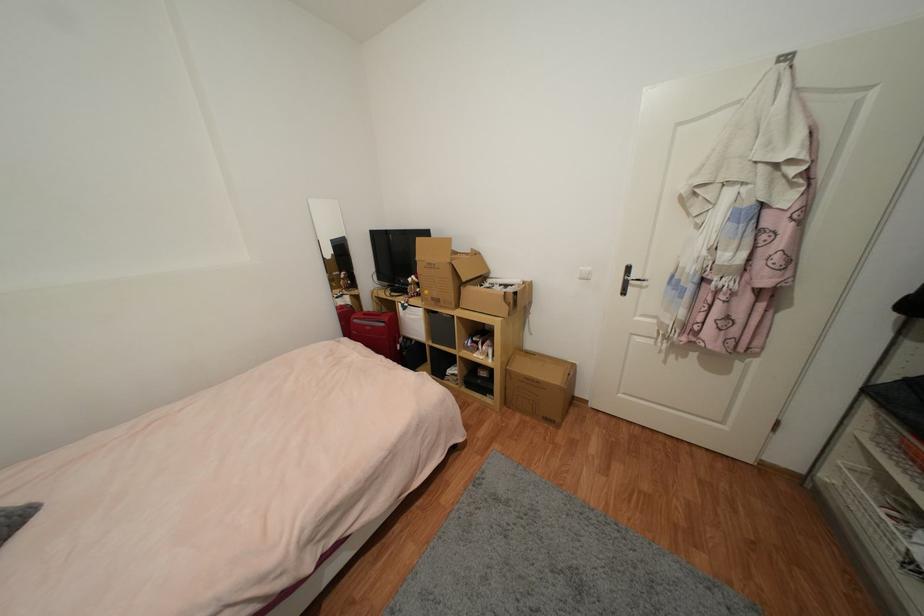
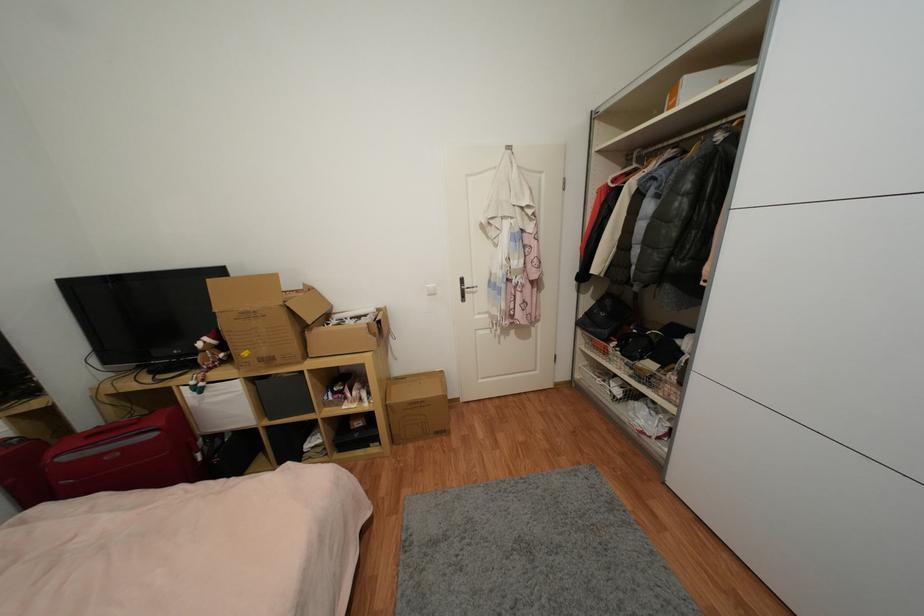
The point at (441, 302) is marked in the first image. Where is the corresponding point in the second image?

(274, 361)